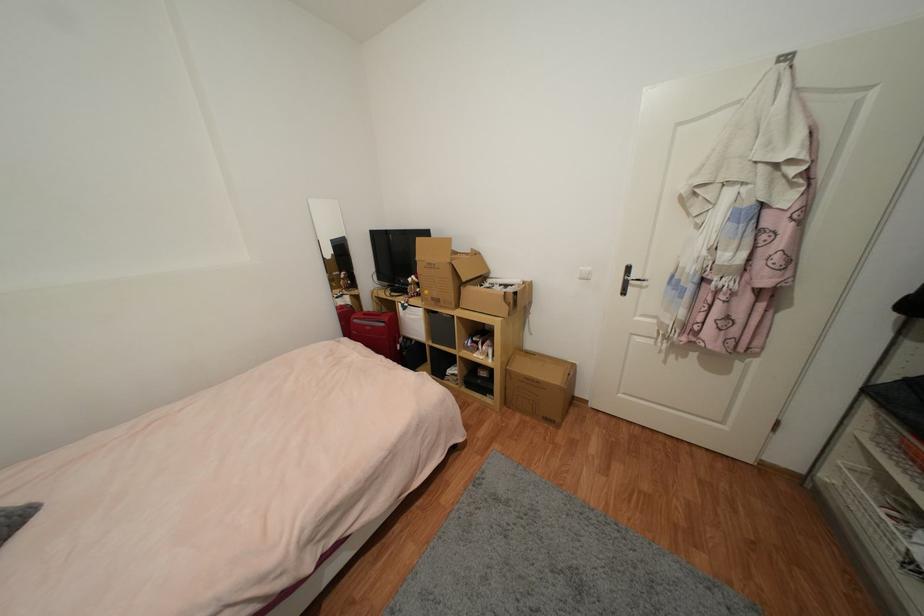
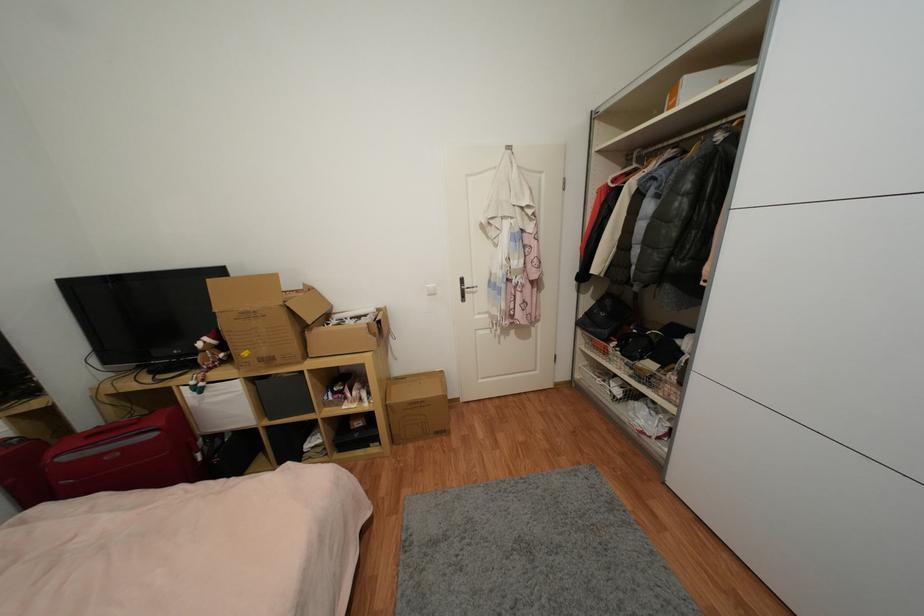
The point at (441, 302) is marked in the first image. Where is the corresponding point in the second image?

(274, 361)